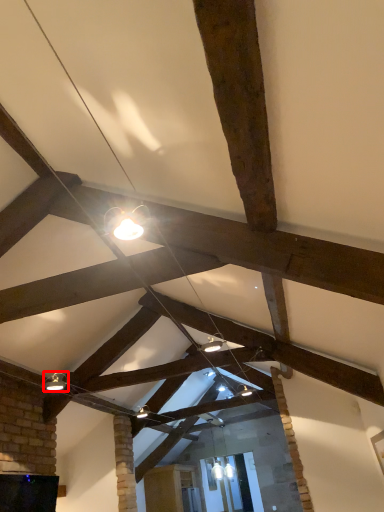
Question: Considering the relative positions of light fixture (annotated by the red box) and furniture in the image provided, where is light fixture (annotated by the red box) located with respect to the staircase?

Choices:
 (A) right
 (B) left

Answer: (B)